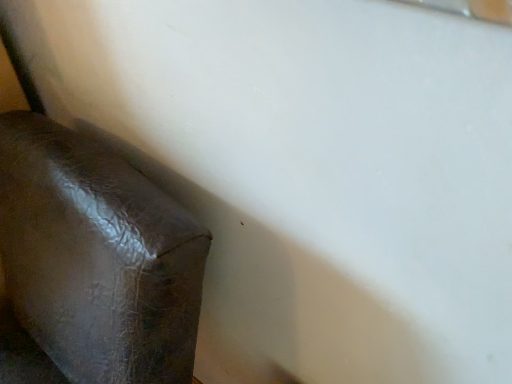
What is the approximate height of leather-like brown at left?

30.46 inches.

What is the approximate width of leather-like brown at left?

leather-like brown at left is 24.10 centimeters wide.

What do you see at coordinates (97, 258) in the screenshot? The image size is (512, 384). I see `leather-like brown at left` at bounding box center [97, 258].

Where is `leather-like brown at left`? leather-like brown at left is located at coordinates (97, 258).

This screenshot has height=384, width=512. What are the coordinates of `leather-like brown at left` in the screenshot? It's located at (97, 258).